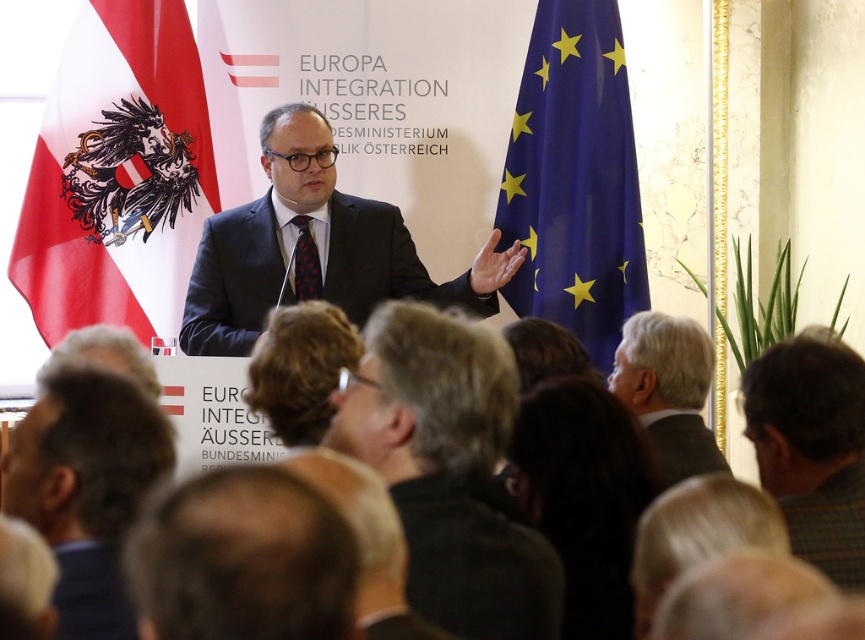
Who is lower down, red and white fabric flag at left or blue fabric flag at right?

blue fabric flag at right is lower down.

Can you confirm if red and white fabric flag at left is wider than blue fabric flag at right?

Correct, the width of red and white fabric flag at left exceeds that of blue fabric flag at right.

Is point (110, 60) in front of point (613, 314)?

No, (110, 60) is further to viewer.

Identify the location of red and white fabric flag at left. The height and width of the screenshot is (640, 865). (117, 173).

Can you confirm if matte black suit at center is smaller than dark brown hair at lower left?

No, matte black suit at center is not smaller than dark brown hair at lower left.

Does point (340, 236) come behind point (54, 400)?

Yes, point (340, 236) is farther from viewer.

Does point (228, 352) come closer to viewer compared to point (84, 518)?

That is False.

Where is `matte black suit at center`? Image resolution: width=865 pixels, height=640 pixels. matte black suit at center is located at coordinates (315, 248).

Which is more to the left, red and white fabric flag at left or dark brown hair at lower left?

red and white fabric flag at left

Does red and white fabric flag at left appear on the left side of dark brown hair at lower left?

Correct, you'll find red and white fabric flag at left to the left of dark brown hair at lower left.

Describe the element at coordinates (117, 173) in the screenshot. The image size is (865, 640). I see `red and white fabric flag at left` at that location.

Identify the location of red and white fabric flag at left. (117, 173).